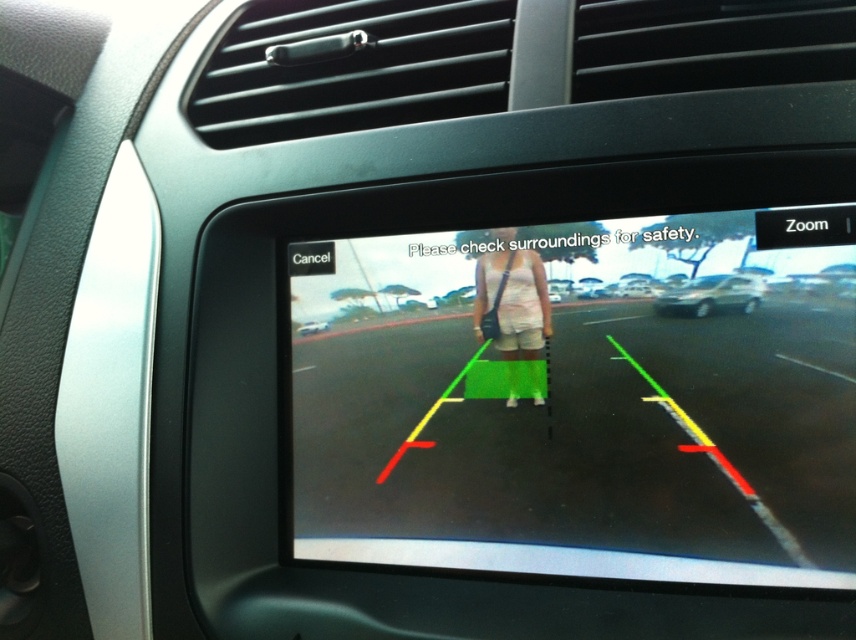
Question: Does white cotton shorts at center appear on the left side of white glossy car at center?

Choices:
 (A) yes
 (B) no

Answer: (B)

Question: Is silver metallic sedan at right further to camera compared to white glossy car at center?

Choices:
 (A) yes
 (B) no

Answer: (B)

Question: Considering the real-world distances, which object is farthest from the silver metallic sedan at right?

Choices:
 (A) matte black display at center
 (B) white glossy car at center

Answer: (B)

Question: Considering the real-world distances, which object is farthest from the silver metallic sedan at right?

Choices:
 (A) white cotton shorts at center
 (B) white glossy car at center

Answer: (B)

Question: Can you confirm if white cotton shorts at center is smaller than white glossy car at center?

Choices:
 (A) yes
 (B) no

Answer: (B)

Question: Based on their relative distances, which object is nearer to the white glossy car at center?

Choices:
 (A) white cotton shorts at center
 (B) silver metallic sedan at right
 (C) matte black display at center

Answer: (A)